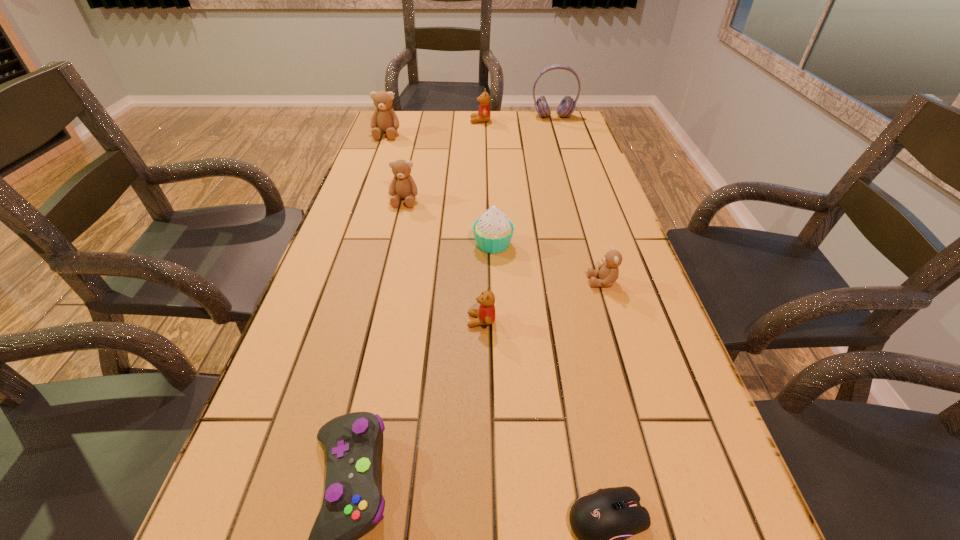
The height and width of the screenshot is (540, 960). I want to click on object that is at the far right corner, so click(x=567, y=105).

Where is `free space at the far edge`? The height and width of the screenshot is (540, 960). free space at the far edge is located at coordinates (500, 137).

At what (x,y) coordinates should I click in order to perform the action: click on vacant area at the left edge. Please return your answer as a coordinate pair (x, y). This screenshot has height=540, width=960. Looking at the image, I should click on (336, 302).

In order to click on vacant space at the right edge of the desktop in this screenshot , I will do `click(588, 156)`.

The image size is (960, 540). In order to click on vacant space at the far left corner in this screenshot , I will do `click(410, 113)`.

Locate an element on the screen. The height and width of the screenshot is (540, 960). vacant point located between the second biggest brown teddy bear and the nearest teddy bear is located at coordinates (443, 261).

Find the location of a particular element. This screenshot has height=540, width=960. free point between the smaller red teddy bear and the headset is located at coordinates (517, 219).

I want to click on free space that is in between the fifth farthest object and the third farthest teddy bear, so click(x=448, y=222).

Where is `unoccupied position between the tallest object and the third nearest teddy bear`? This screenshot has height=540, width=960. unoccupied position between the tallest object and the third nearest teddy bear is located at coordinates (479, 159).

Where is `free space between the farther red teddy bear and the third farthest teddy bear`? free space between the farther red teddy bear and the third farthest teddy bear is located at coordinates (443, 161).